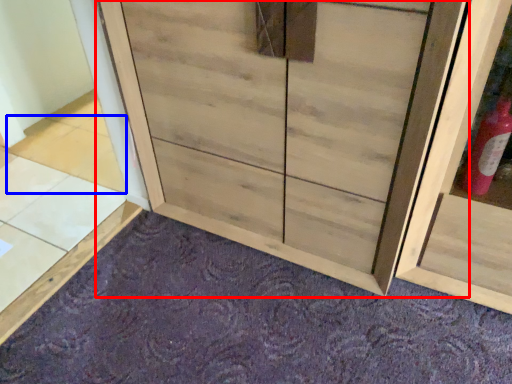
Question: Which object appears closest to the camera in this image, cupboard (highlighted by a red box) or tile (highlighted by a blue box)?

Choices:
 (A) cupboard
 (B) tile

Answer: (A)